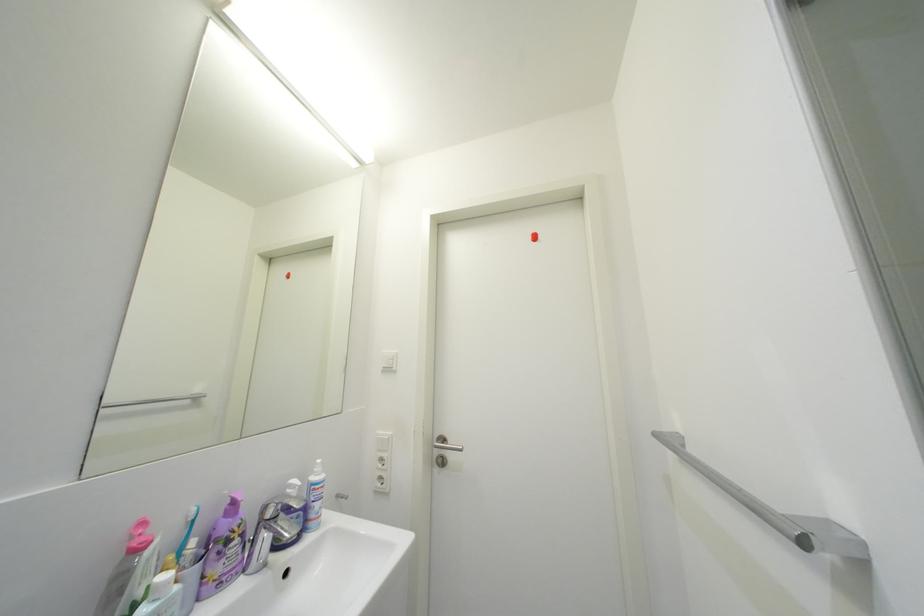
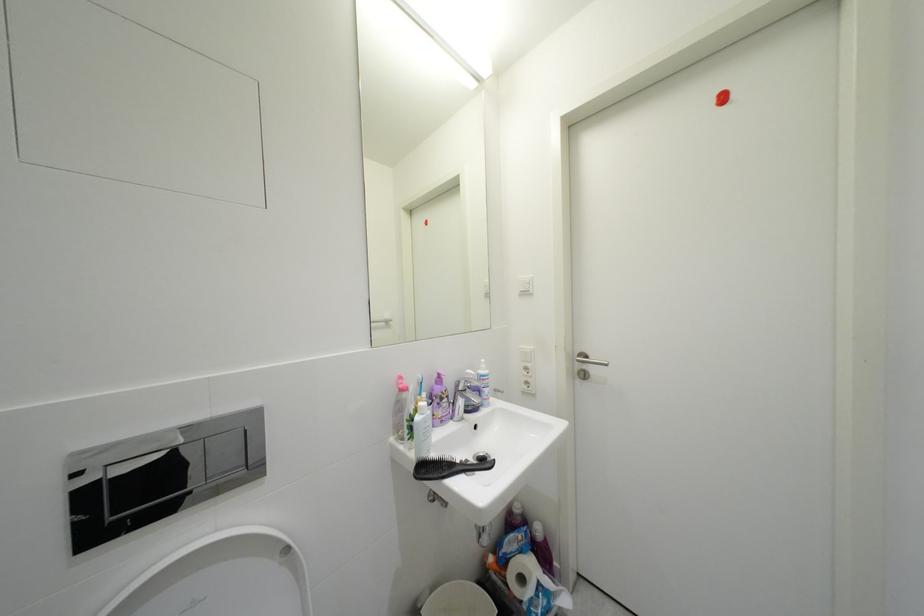
Which direction would the cameraman need to move to produce the second image?

The cameraman moved toward left, backward.